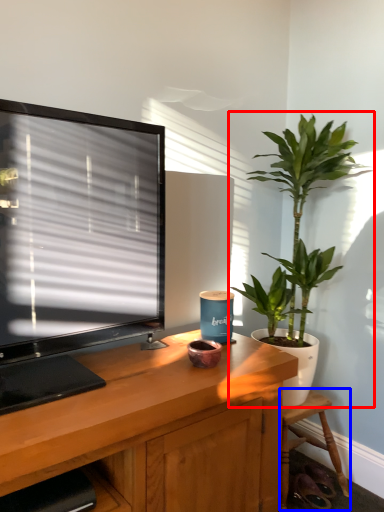
Question: Among these objects, which one is farthest to the camera, houseplant (highlighted by a red box) or chair (highlighted by a blue box)?

Choices:
 (A) houseplant
 (B) chair

Answer: (B)